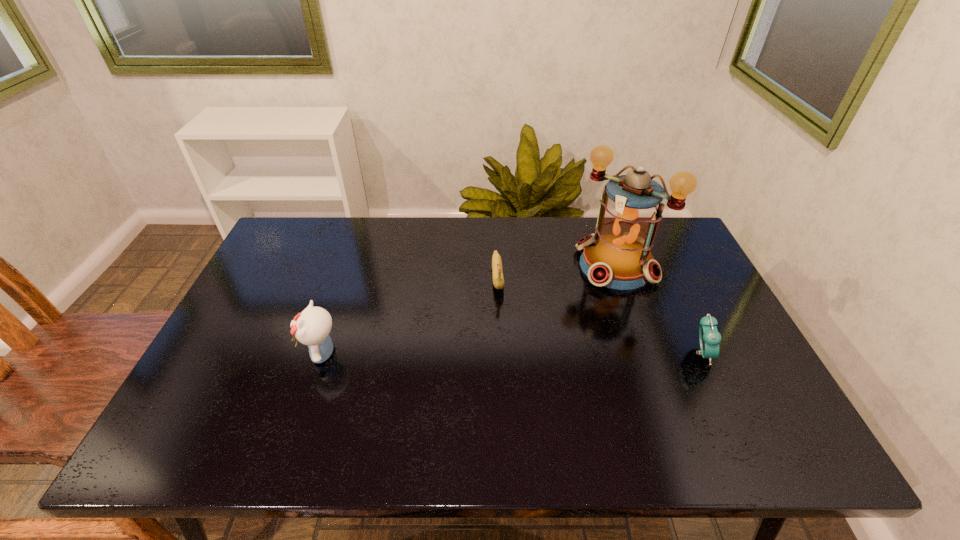
Where is `vacant space located 0.400m on the front-facing side of the tallest object`? vacant space located 0.400m on the front-facing side of the tallest object is located at coordinates (515, 370).

The width and height of the screenshot is (960, 540). I want to click on vacant space situated 0.300m at the stem of the third object from right to left, so click(x=506, y=384).

Find the location of a particular element. This screenshot has width=960, height=540. free location located at the stem of the third object from right to left is located at coordinates (504, 361).

This screenshot has width=960, height=540. I want to click on free location located 0.330m at the stem of the third object from right to left, so click(x=507, y=395).

The height and width of the screenshot is (540, 960). I want to click on lantern located at the far edge, so click(x=617, y=256).

The image size is (960, 540). Identify the location of banana present at the far edge. (498, 280).

Where is `alarm clock present at the right edge`? The height and width of the screenshot is (540, 960). alarm clock present at the right edge is located at coordinates (710, 338).

Where is `lantern that is at the right edge`? The width and height of the screenshot is (960, 540). lantern that is at the right edge is located at coordinates (617, 256).

Where is `object at the far right corner`? Image resolution: width=960 pixels, height=540 pixels. object at the far right corner is located at coordinates (617, 256).

The image size is (960, 540). In order to click on vacant space at the far edge of the desktop in this screenshot , I will do `click(426, 240)`.